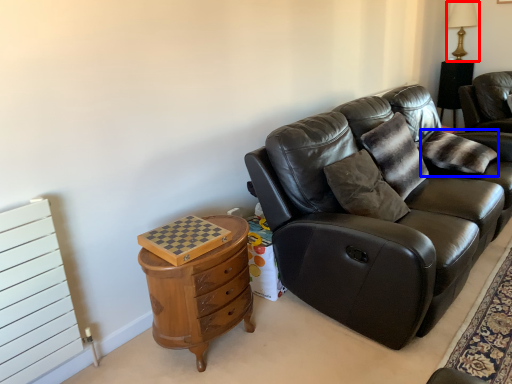
Question: Among these objects, which one is nearest to the camera, table lamp (highlighted by a red box) or pillow (highlighted by a blue box)?

Choices:
 (A) table lamp
 (B) pillow

Answer: (B)